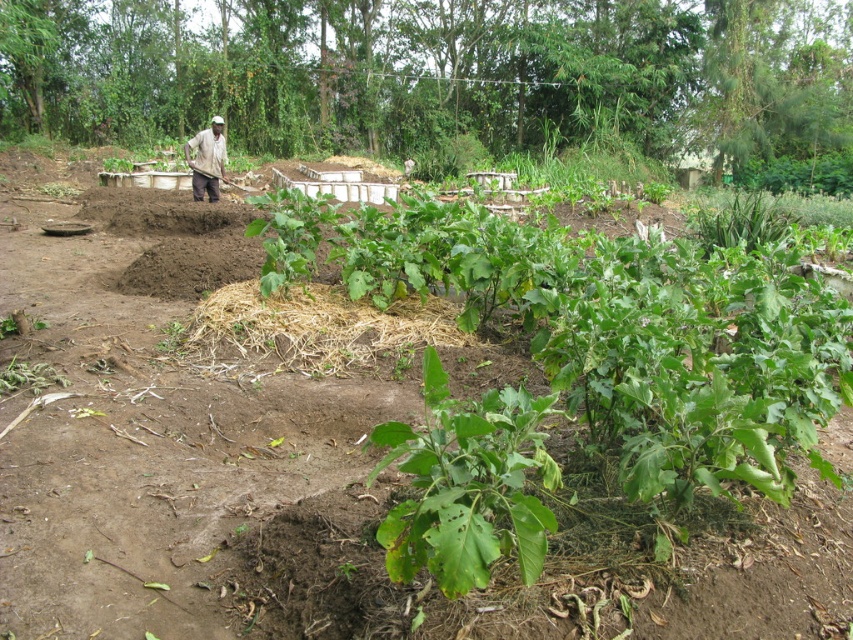
Is point (495, 422) positioned after point (215, 163)?

That is False.

Is point (387, 531) in front of point (207, 182)?

That is True.

Who is more forward, (x=397, y=512) or (x=190, y=184)?

Positioned in front is point (x=397, y=512).

Find the location of a particular element. green leafy plant at center is located at coordinates (467, 484).

Can you confirm if brown straw at center is positioned to the right of dark brown skin at center?

Yes, brown straw at center is to the right of dark brown skin at center.

Between brown straw at center and dark brown skin at center, which one has less height?

With less height is dark brown skin at center.

What are the coordinates of `brown straw at center` in the screenshot? It's located at (318, 326).

Does green leafy plant at center come in front of brown straw at center?

Yes, it is in front of brown straw at center.

Which is in front, point (450, 476) or point (412, 340)?

Positioned in front is point (450, 476).

The height and width of the screenshot is (640, 853). Describe the element at coordinates (467, 484) in the screenshot. I see `green leafy plant at center` at that location.

Identify the location of green leafy plant at center. (467, 484).